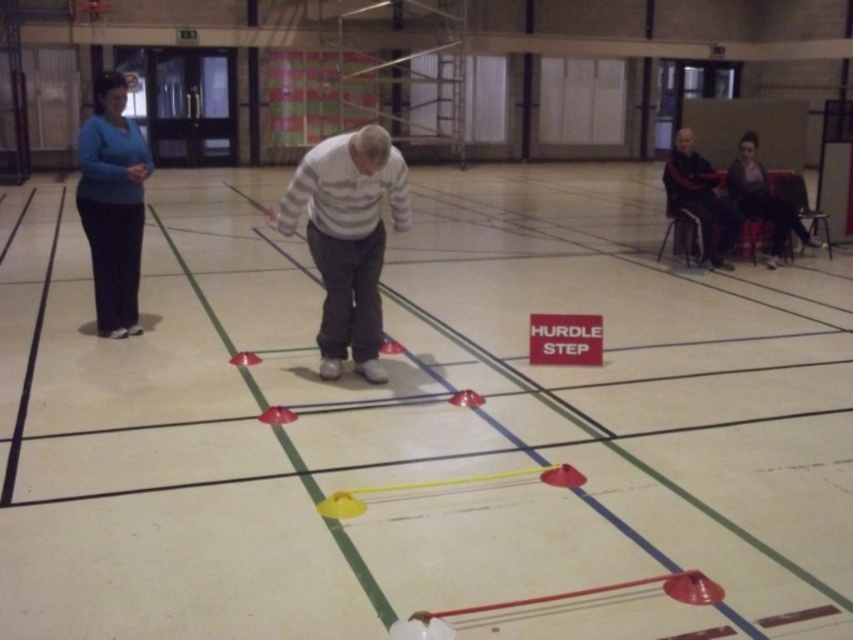
Question: Can you confirm if dark gray fabric jacket at upper right is wider than red plastic cone at center?

Choices:
 (A) yes
 (B) no

Answer: (A)

Question: Is white striped sweater at center wider than matte blue sweater at left?

Choices:
 (A) yes
 (B) no

Answer: (A)

Question: Which of these objects is positioned closest to the dark gray sweater at upper right?

Choices:
 (A) white striped sweater at center
 (B) dark gray fabric jacket at upper right

Answer: (B)

Question: Which point is closer to the camera?

Choices:
 (A) dark gray fabric jacket at upper right
 (B) white striped sweater at center
 (C) red plastic cone at center

Answer: (C)

Question: Does matte blue sweater at left have a smaller size compared to dark gray sweater at upper right?

Choices:
 (A) yes
 (B) no

Answer: (A)

Question: Which object appears closest to the camera in this image?

Choices:
 (A) red plastic cone at center
 (B) dark gray fabric jacket at upper right

Answer: (A)